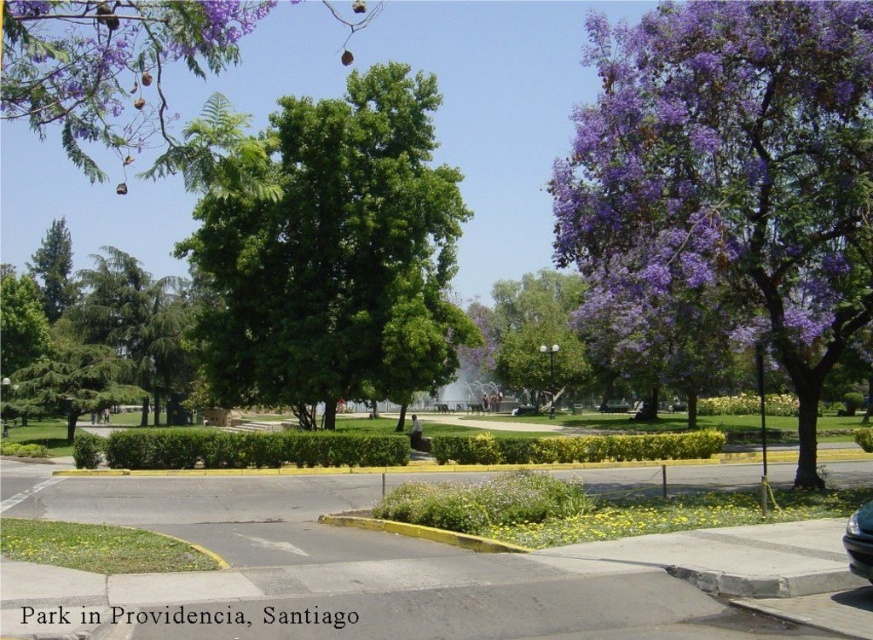
From the picture: Who is higher up, purple leafy tree at right or green leafy tree at center?

green leafy tree at center is above.

Can you confirm if purple leafy tree at right is thinner than green leafy tree at center?

Indeed, purple leafy tree at right has a lesser width compared to green leafy tree at center.

You are a GUI agent. You are given a task and a screenshot of the screen. Output one action in this format:
    pyautogui.click(x=<x>, y=<y>)
    Task: Click on the purple leafy tree at right
    
    Given the screenshot: What is the action you would take?
    pyautogui.click(x=733, y=170)

This screenshot has width=873, height=640. In order to click on purple leafy tree at right in this screenshot , I will do `click(733, 170)`.

Which is more to the left, purple leafy tree at right or shiny black car at lower right?

shiny black car at lower right

Who is more forward, (825, 205) or (856, 556)?

Point (856, 556)

Locate an element on the screen. The width and height of the screenshot is (873, 640). purple leafy tree at right is located at coordinates (733, 170).

Is green leafy tree at upper left bigger than green matte tree at left?

Yes.

Identify the location of green leafy tree at upper left. This screenshot has height=640, width=873. (114, 70).